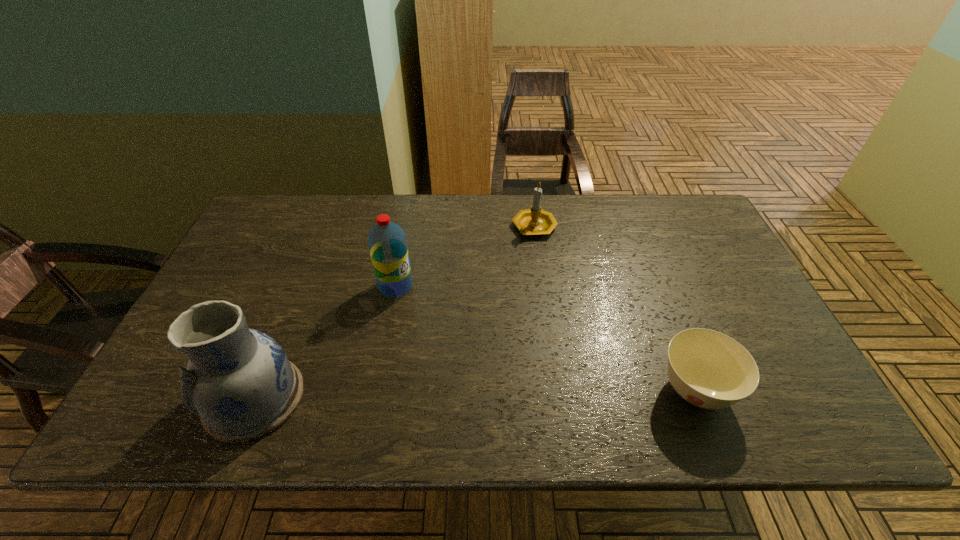
Locate an element on the screen. This screenshot has width=960, height=540. object present at the near left corner is located at coordinates (240, 382).

Locate an element on the screen. The image size is (960, 540). object that is at the near right corner is located at coordinates (708, 369).

Where is `free space at the far edge of the desktop`? free space at the far edge of the desktop is located at coordinates (x=617, y=205).

Where is `free point at the near edge`? This screenshot has width=960, height=540. free point at the near edge is located at coordinates (467, 377).

I want to click on vacant region at the left edge of the desktop, so click(x=252, y=248).

At what (x,y) coordinates should I click in order to perform the action: click on vacant region at the right edge of the desktop. Please return your answer as a coordinate pair (x, y). Image resolution: width=960 pixels, height=540 pixels. Looking at the image, I should click on (742, 315).

You are a GUI agent. You are given a task and a screenshot of the screen. Output one action in this format:
    pyautogui.click(x=<x>, y=<y>)
    Task: Click on the vacant space at the near left corner of the desktop
    
    Given the screenshot: What is the action you would take?
    pyautogui.click(x=180, y=392)

You are a GUI agent. You are given a task and a screenshot of the screen. Output one action in this format:
    pyautogui.click(x=<x>, y=<y>)
    Task: Click on the unoccupied position between the pottery and the second object from left to right
    
    Given the screenshot: What is the action you would take?
    pyautogui.click(x=325, y=342)

Find the location of a particular element. free space that is in between the pottery and the rightmost object is located at coordinates (475, 394).

The image size is (960, 540). I want to click on empty location between the farthest object and the rightmost object, so click(614, 309).